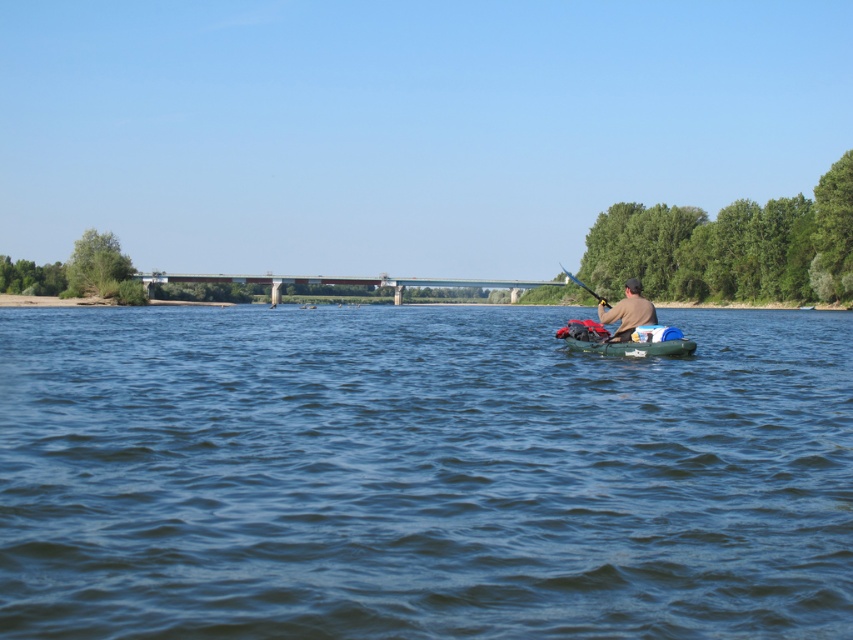
You are a photographer trying to capture the brown leather jacket at center in your shot. The camera you are using has a rectangular viewfinder with a 0.5x0.5 aspect ratio. What is the minimum area of the viewfinder you need to cover to ensure the jacket is fully visible?

The minimum area required is 0.25 square units since the viewfinder has a 0.5x0.5 aspect ratio, which gives an area of 0.25. This ensures the jacket at point (628, 310) is fully within the frame.